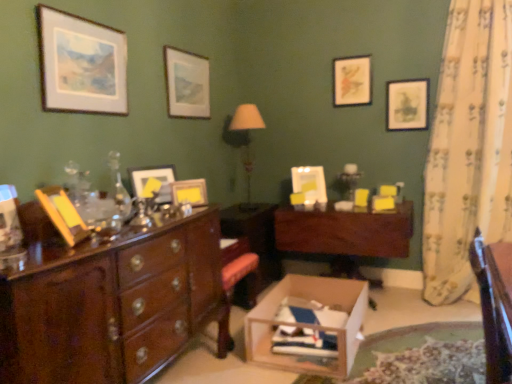
Question: Considering the relative sizes of matte black picture frame at upper right, arranged as the 5th picture frame when viewed from the front, and matte white picture frame at upper left, which appears as the first picture frame when viewed from the front, in the image provided, is matte black picture frame at upper right, arranged as the 5th picture frame when viewed from the front, bigger than matte white picture frame at upper left, which appears as the first picture frame when viewed from the front,?

Choices:
 (A) no
 (B) yes

Answer: (A)

Question: Is matte black picture frame at upper right, arranged as the 5th picture frame when viewed from the front, positioned before matte white picture frame at upper left, which appears as the first picture frame when viewed from the front?

Choices:
 (A) no
 (B) yes

Answer: (A)

Question: Is matte black picture frame at upper right, placed as the second picture frame when sorted from back to front, smaller than matte white picture frame at upper left, acting as the 6th picture frame starting from the right?

Choices:
 (A) yes
 (B) no

Answer: (A)

Question: Is matte black picture frame at upper right, which is the first picture frame from right to left, positioned far away from matte white picture frame at upper left, which appears as the first picture frame when viewed from the front?

Choices:
 (A) yes
 (B) no

Answer: (A)

Question: From a real-world perspective, does matte black picture frame at upper right, arranged as the 5th picture frame when viewed from the front, sit lower than matte white picture frame at upper left, which appears as the first picture frame when viewed from the front?

Choices:
 (A) no
 (B) yes

Answer: (B)

Question: Is matte white picture frame at upper left, which appears as the first picture frame when viewed from the front, surrounded by matte black picture frame at upper right, which is the first picture frame from right to left?

Choices:
 (A) yes
 (B) no

Answer: (B)

Question: Could you tell me if matte white picture frame at upper center, which appears as the 3th picture frame when viewed from the back, is turned towards white floral fabric curtain at right?

Choices:
 (A) yes
 (B) no

Answer: (A)

Question: Does matte white picture frame at upper center, which ranks as the fourth picture frame in right-to-left order, have a greater width compared to white floral fabric curtain at right?

Choices:
 (A) yes
 (B) no

Answer: (B)

Question: Is matte white picture frame at upper center, the 4th picture frame viewed from the front, next to white floral fabric curtain at right?

Choices:
 (A) yes
 (B) no

Answer: (B)

Question: Is matte white picture frame at upper center, the 4th picture frame viewed from the front, not inside white floral fabric curtain at right?

Choices:
 (A) yes
 (B) no

Answer: (A)

Question: Considering the relative sizes of matte white picture frame at upper center, the 4th picture frame viewed from the front, and white floral fabric curtain at right in the image provided, is matte white picture frame at upper center, the 4th picture frame viewed from the front, taller than white floral fabric curtain at right?

Choices:
 (A) no
 (B) yes

Answer: (A)

Question: From the image's perspective, is matte white picture frame at upper center, which appears as the 3th picture frame when viewed from the back, below white floral fabric curtain at right?

Choices:
 (A) yes
 (B) no

Answer: (B)

Question: Does matte gold picture frame at upper right, placed as the 5th picture frame when sorted from left to right, have a lesser width compared to matte white picture frame at upper left, which appears as the first picture frame when viewed from the front?

Choices:
 (A) yes
 (B) no

Answer: (A)